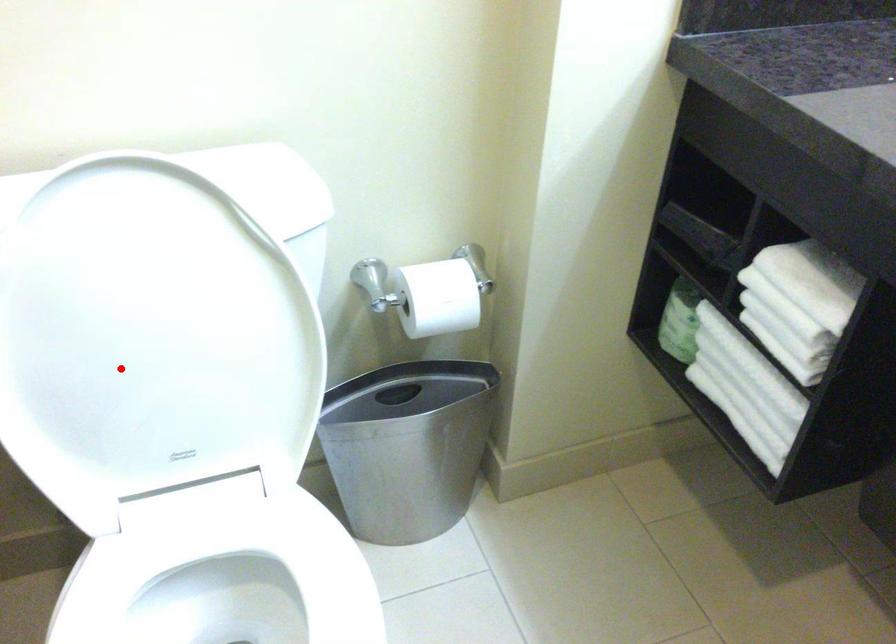
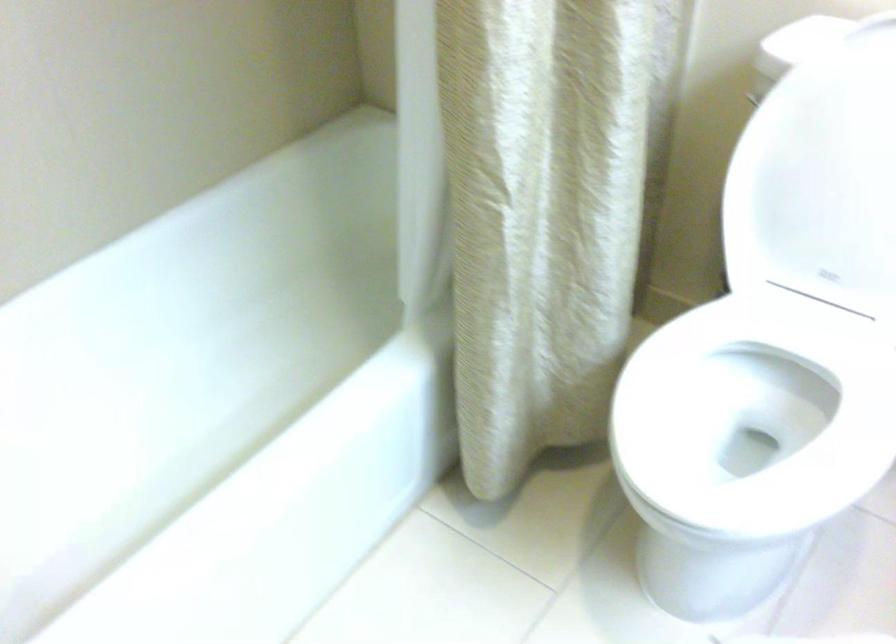
Question: A red point is marked in image1. In image2, is the corresponding 3D point closer to the camera or farther? Reply with the corresponding letter.

Choices:
 (A) The corresponding 3D point is closer.
 (B) The corresponding 3D point is farther.

Answer: (B)